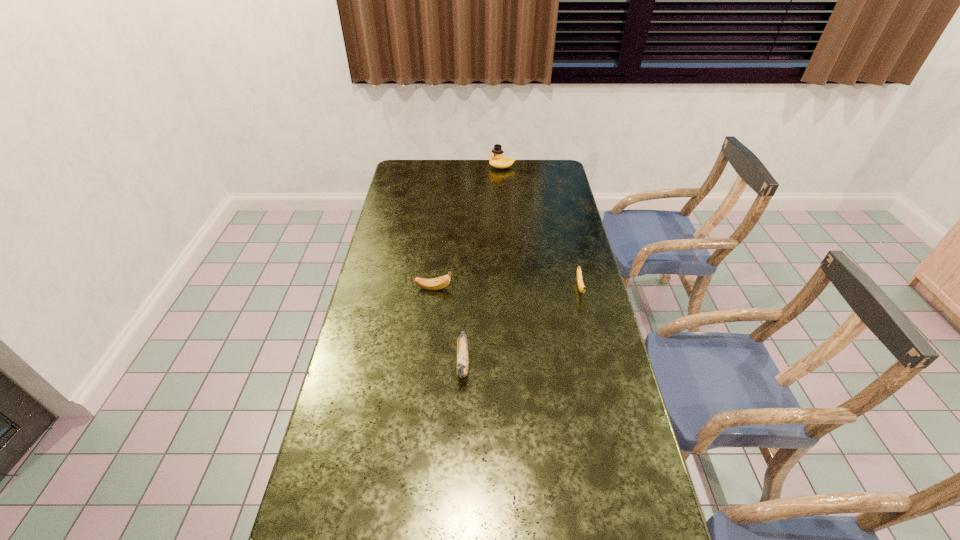
I want to click on empty space between the shortest object and the farthest object, so click(540, 227).

Where is `vacant area between the second banana from right to left and the duck`? The width and height of the screenshot is (960, 540). vacant area between the second banana from right to left and the duck is located at coordinates (482, 265).

At what (x,y) coordinates should I click in order to perform the action: click on vacant space in between the leftmost banana and the second object from right to left. Please return your answer as a coordinate pair (x, y). The height and width of the screenshot is (540, 960). Looking at the image, I should click on (468, 227).

You are a GUI agent. You are given a task and a screenshot of the screen. Output one action in this format:
    pyautogui.click(x=<x>, y=<y>)
    Task: Click on the vacant space that is in between the second shortest banana and the tallest object
    The image size is (960, 540).
    Given the screenshot: What is the action you would take?
    pyautogui.click(x=468, y=227)

Identify the location of free space between the leftmost banana and the second tallest object. (448, 325).

You are a GUI agent. You are given a task and a screenshot of the screen. Output one action in this format:
    pyautogui.click(x=<x>, y=<y>)
    Task: Click on the free space between the rightmost object and the second shortest banana
    
    Given the screenshot: What is the action you would take?
    pyautogui.click(x=507, y=288)

The height and width of the screenshot is (540, 960). What are the coordinates of `free spot between the duck and the rightmost object` in the screenshot? It's located at (540, 227).

You are a GUI agent. You are given a task and a screenshot of the screen. Output one action in this format:
    pyautogui.click(x=<x>, y=<y>)
    Task: Click on the vacant point located between the tallest object and the second tallest object
    This screenshot has width=960, height=540.
    Given the screenshot: What is the action you would take?
    pyautogui.click(x=482, y=265)

The image size is (960, 540). Find the location of `free space between the third object from left to right and the second shortest banana`. free space between the third object from left to right and the second shortest banana is located at coordinates (468, 227).

The height and width of the screenshot is (540, 960). Identify the location of the closest object relative to the leftmost object. (462, 347).